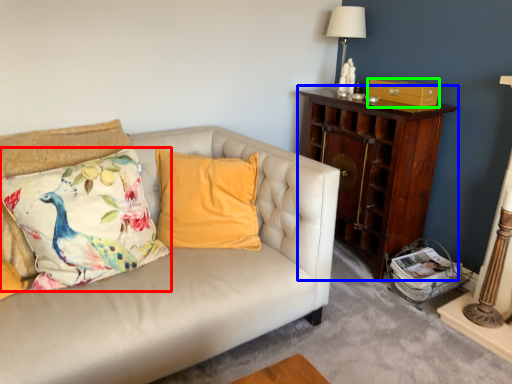
Question: Which object is the farthest from pillow (highlighted by a red box)? Choose among these: nightstand (highlighted by a blue box) or drawer (highlighted by a green box).

Choices:
 (A) nightstand
 (B) drawer

Answer: (B)